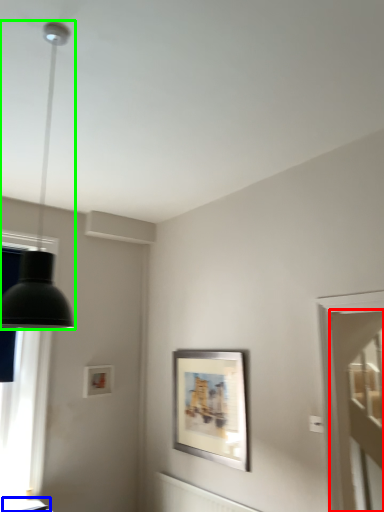
Question: Considering the real-world distances, which object is farthest from glass door (highlighted by a red box)? table (highlighted by a blue box) or lamp (highlighted by a green box)?

Choices:
 (A) table
 (B) lamp

Answer: (B)